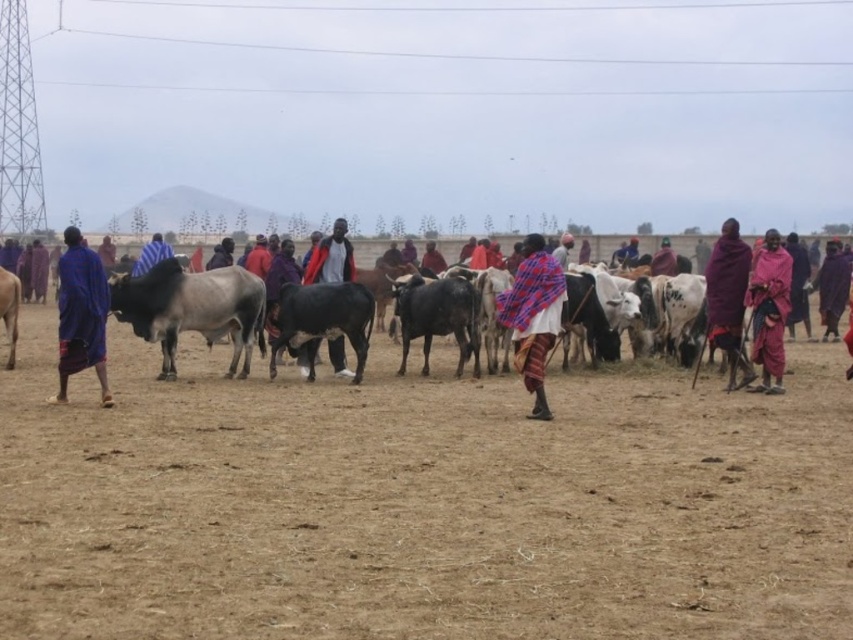
Question: Which point is farther from the camera taking this photo?

Choices:
 (A) (724, 273)
 (B) (776, 326)
 (C) (161, 497)

Answer: (A)

Question: Observing the image, what is the correct spatial positioning of blue fabric person at center in reference to black glossy bull at center?

Choices:
 (A) left
 (B) right

Answer: (B)

Question: Which object appears closest to the camera in this image?

Choices:
 (A) purple woven cloth at right
 (B) dark blue fabric at center

Answer: (A)

Question: Which object is the closest to the dark blue fabric at center?

Choices:
 (A) purple woven cloth at center-right
 (B) blue woven cloth at left
 (C) brown textured cow at left

Answer: (B)

Question: Is blue woven cloth at left above white speckled hide at center?

Choices:
 (A) yes
 (B) no

Answer: (A)

Question: Is brown sandy dirt at center below blue woven cloth at left?

Choices:
 (A) yes
 (B) no

Answer: (A)